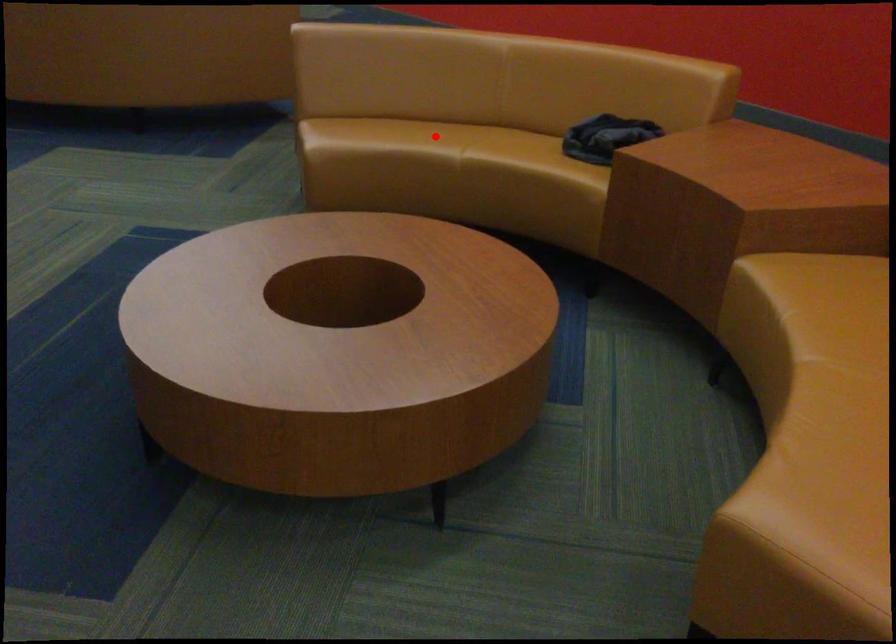
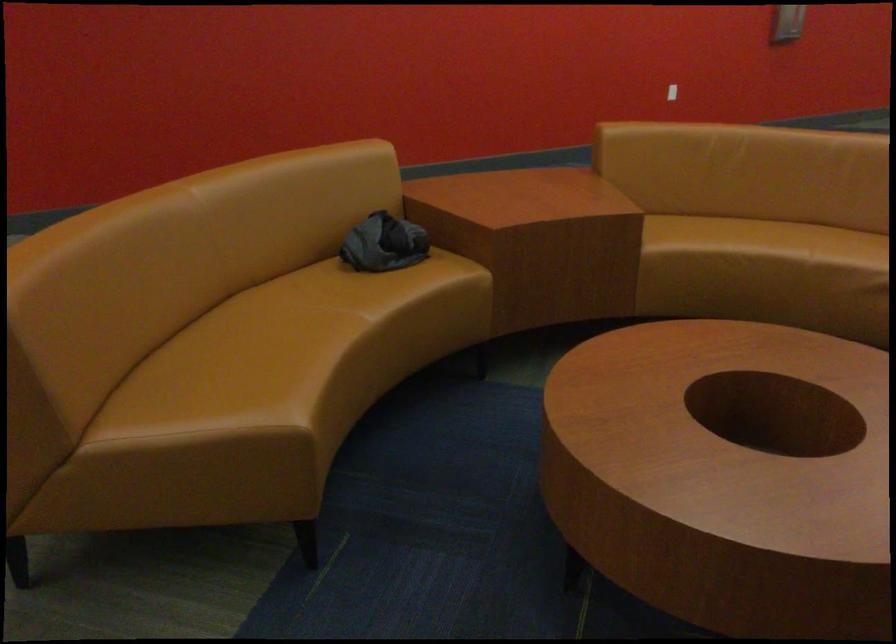
Locate, in the second image, the point that corresponds to the highlighted location in the first image.

(271, 336)